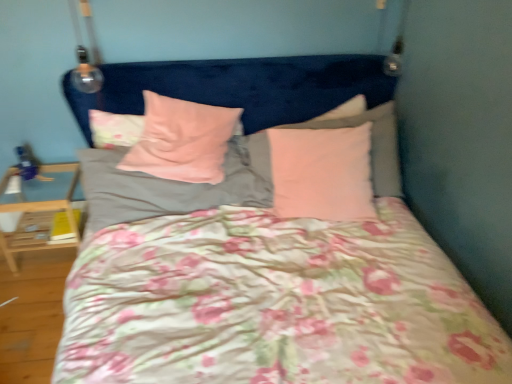
Question: Is there a large distance between pink matte pillow at upper right, which is the second pillow in right-to-left order, and pink velvety pillow at center, the third pillow when ordered from right to left?

Choices:
 (A) yes
 (B) no

Answer: (B)

Question: From a real-world perspective, is pink matte pillow at upper right, which ranks as the fourth pillow in left-to-right order, positioned under pink velvety pillow at center, positioned as the 3th pillow in left-to-right order, based on gravity?

Choices:
 (A) yes
 (B) no

Answer: (A)

Question: Is pink velvety pillow at center, positioned as the 3th pillow in left-to-right order, at the back of pink matte pillow at upper right, which is the second pillow in right-to-left order?

Choices:
 (A) yes
 (B) no

Answer: (B)

Question: Considering the relative sizes of pink matte pillow at upper right, which is the second pillow in right-to-left order, and pink velvety pillow at center, positioned as the 3th pillow in left-to-right order, in the image provided, is pink matte pillow at upper right, which is the second pillow in right-to-left order, taller than pink velvety pillow at center, positioned as the 3th pillow in left-to-right order,?

Choices:
 (A) yes
 (B) no

Answer: (A)

Question: Considering the relative sizes of pink matte pillow at upper right, which ranks as the fourth pillow in left-to-right order, and pink velvety pillow at center, positioned as the 3th pillow in left-to-right order, in the image provided, is pink matte pillow at upper right, which ranks as the fourth pillow in left-to-right order, wider than pink velvety pillow at center, positioned as the 3th pillow in left-to-right order,?

Choices:
 (A) yes
 (B) no

Answer: (A)

Question: Looking at the image, does pink velvety pillow at center, the third pillow when ordered from right to left, seem bigger or smaller compared to pink soft fabric pillow at center, positioned as the 2th pillow in left-to-right order?

Choices:
 (A) small
 (B) big

Answer: (A)

Question: Which is correct: pink velvety pillow at center, positioned as the 3th pillow in left-to-right order, is inside pink soft fabric pillow at center, positioned as the 2th pillow in left-to-right order, or outside of it?

Choices:
 (A) inside
 (B) outside

Answer: (B)

Question: From the image's perspective, is pink velvety pillow at center, the third pillow when ordered from right to left, above or below pink soft fabric pillow at center, the fourth pillow when ordered from right to left?

Choices:
 (A) below
 (B) above

Answer: (B)

Question: From a real-world perspective, is pink velvety pillow at center, the third pillow when ordered from right to left, positioned above or below pink soft fabric pillow at center, positioned as the 2th pillow in left-to-right order?

Choices:
 (A) above
 (B) below

Answer: (A)

Question: Looking at their shapes, would you say light wood/wooden table at lower left is wider or thinner than pink soft fabric pillow at center, positioned as the 2th pillow in left-to-right order?

Choices:
 (A) wide
 (B) thin

Answer: (A)

Question: Is light wood/wooden table at lower left inside or outside of pink soft fabric pillow at center, the fourth pillow when ordered from right to left?

Choices:
 (A) outside
 (B) inside

Answer: (A)

Question: Is light wood/wooden table at lower left bigger or smaller than pink soft fabric pillow at center, positioned as the 2th pillow in left-to-right order?

Choices:
 (A) big
 (B) small

Answer: (A)

Question: From a real-world perspective, is light wood/wooden table at lower left physically located above or below pink soft fabric pillow at center, the fourth pillow when ordered from right to left?

Choices:
 (A) above
 (B) below

Answer: (B)

Question: In terms of width, does floral fabric pillow at upper left, the first pillow when ordered from left to right, look wider or thinner when compared to light wood/wooden table at lower left?

Choices:
 (A) thin
 (B) wide

Answer: (A)

Question: Considering their positions, is floral fabric pillow at upper left, the first pillow when ordered from left to right, located in front of or behind light wood/wooden table at lower left?

Choices:
 (A) behind
 (B) front

Answer: (B)